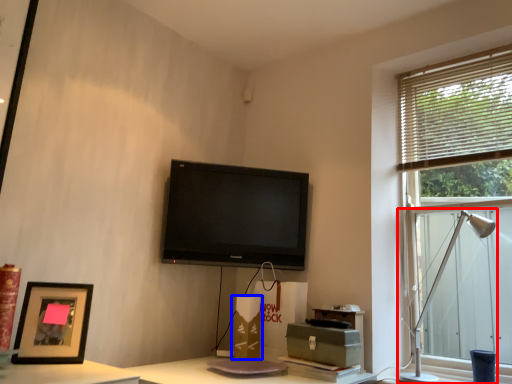
Question: Which object appears farthest to the camera in this image, table lamp (highlighted by a red box) or cardboard box (highlighted by a blue box)?

Choices:
 (A) table lamp
 (B) cardboard box

Answer: (B)